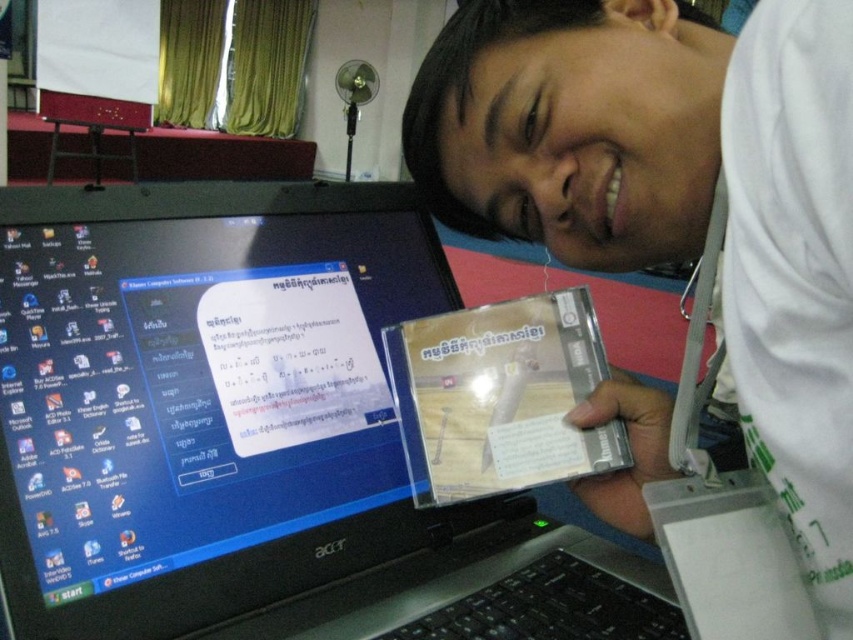
Is black plastic laptop at center positioned in front of white matte cd case at center?

No, it is not.

Who is shorter, black plastic laptop at center or white matte cd case at center?

With less height is black plastic laptop at center.

Which is in front, point (381, 410) or point (595, 506)?

Point (595, 506)

Where is `black plastic laptop at center`? black plastic laptop at center is located at coordinates (252, 433).